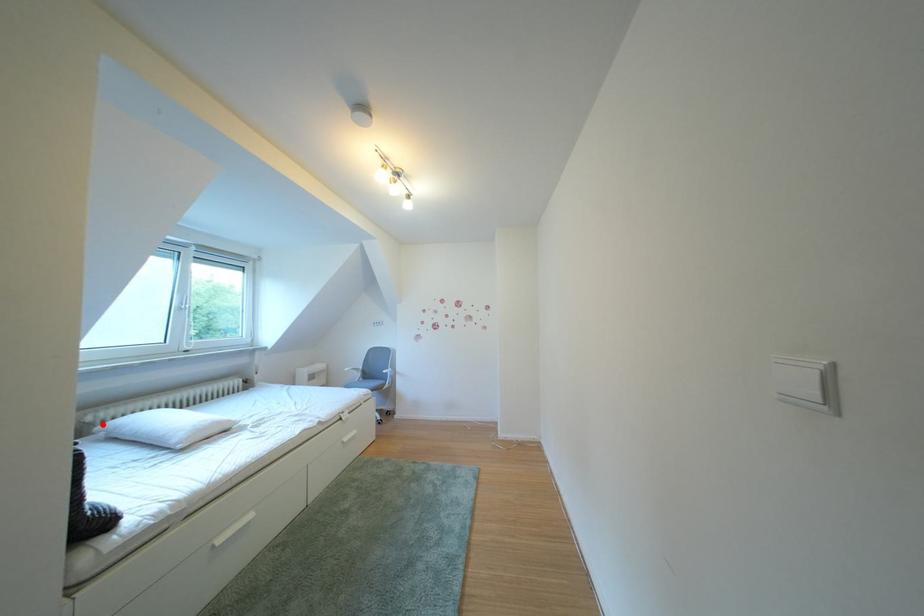
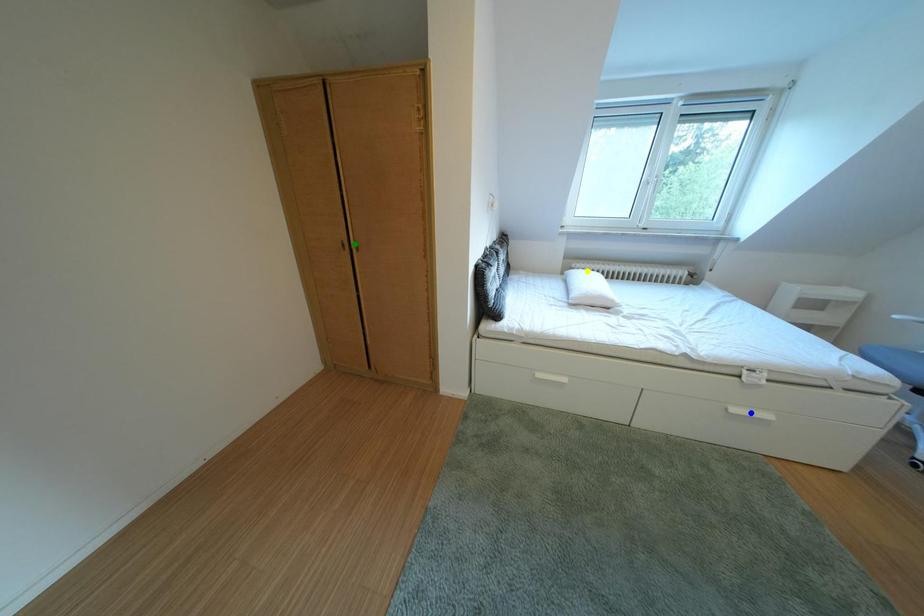
Question: I am providing you with two images of the same scene from different viewpoints. A red point is marked on the first image. You are given multiple points on the second image. Which spot in image 2 lines up with the point in image 1?

Choices:
 (A) yellow point
 (B) green point
 (C) blue point

Answer: (A)